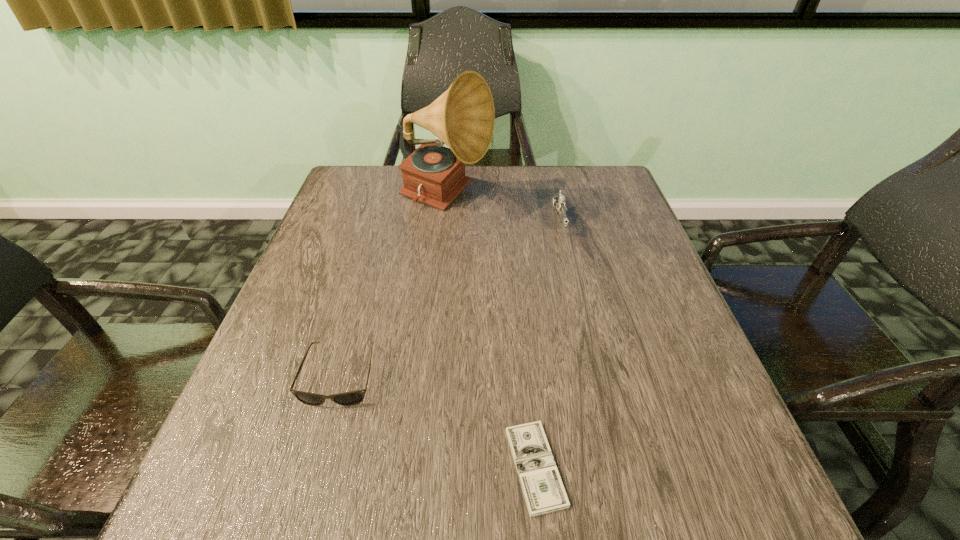
Find the location of `the tallest object`. the tallest object is located at coordinates (463, 117).

In order to click on the rightmost object in this screenshot , I will do `click(559, 202)`.

I want to click on the second tallest object, so coord(559,202).

The width and height of the screenshot is (960, 540). What are the coordinates of `the second nearest object` in the screenshot? It's located at (350, 398).

You are a GUI agent. You are given a task and a screenshot of the screen. Output one action in this format:
    pyautogui.click(x=<x>, y=<y>)
    Task: Click on the third tallest object
    Image resolution: width=960 pixels, height=540 pixels.
    Given the screenshot: What is the action you would take?
    coord(350,398)

You are a GUI agent. You are given a task and a screenshot of the screen. Output one action in this format:
    pyautogui.click(x=<x>, y=<y>)
    Task: Click on the shortest object
    Image resolution: width=960 pixels, height=540 pixels.
    Given the screenshot: What is the action you would take?
    pyautogui.click(x=542, y=486)

The width and height of the screenshot is (960, 540). What are the coordinates of `the nearest object` in the screenshot? It's located at (542, 486).

Find the location of a particular element. Image resolution: width=960 pixels, height=540 pixels. free point located on the horn of the tallest object is located at coordinates (529, 200).

You are a GUI agent. You are given a task and a screenshot of the screen. Output one action in this format:
    pyautogui.click(x=<x>, y=<y>)
    Task: Click on the free space located 0.330m aimed along the barrel of the gun
    Image resolution: width=960 pixels, height=540 pixels.
    Given the screenshot: What is the action you would take?
    pyautogui.click(x=588, y=338)

Find the location of `vacant area situated on the lenses of the sunglasses`. vacant area situated on the lenses of the sunglasses is located at coordinates (295, 537).